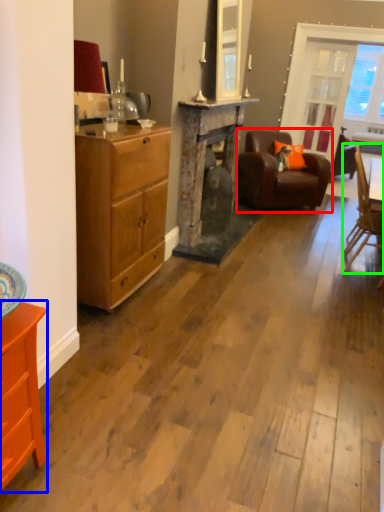
Question: Which object is positioned closest to chair (highlighted by a red box)? Select from cabinetry (highlighted by a blue box) and chair (highlighted by a green box).

Choices:
 (A) cabinetry
 (B) chair

Answer: (B)